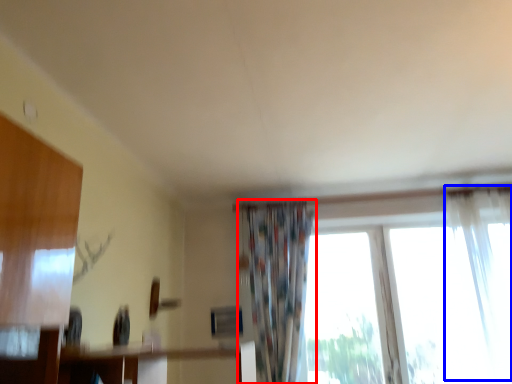
Question: Which object appears closest to the camera in this image, curtain (highlighted by a red box) or curtain (highlighted by a blue box)?

Choices:
 (A) curtain
 (B) curtain

Answer: (B)